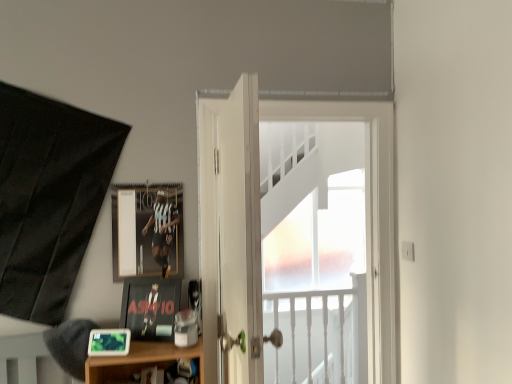
Question: Is white wooden door at center, positioned as the 2th door in back-to-front order, spatially inside white glossy door at center, marked as the first door in a back-to-front arrangement, or outside of it?

Choices:
 (A) outside
 (B) inside

Answer: (A)

Question: In the image, is white wooden door at center, which is the 1th door from front to back, positioned in front of or behind white glossy door at center, marked as the first door in a back-to-front arrangement?

Choices:
 (A) behind
 (B) front

Answer: (B)

Question: Which object is positioned closest to the white frosted glass at center?

Choices:
 (A) metallic silver picture frame at upper left, marked as the first picture frame in a top-to-bottom arrangement
 (B) white glossy door at center, positioned as the second door in front-to-back order
 (C) matte black picture frame at lower left, the second picture frame viewed from the front
 (D) white wooden door at center, which is the 1th door from front to back
 (E) matte black picture frame at lower left, which is the 1th picture frame from front to back

Answer: (B)

Question: Considering the real-world distances, which object is closest to the white wooden door at center, which is the 1th door from front to back?

Choices:
 (A) matte black picture frame at lower left, the second picture frame from the top
 (B) metallic silver picture frame at upper left, marked as the first picture frame in a top-to-bottom arrangement
 (C) white glossy door at center, positioned as the second door in front-to-back order
 (D) matte black picture frame at lower left, which is the 1th picture frame from front to back
 (E) white frosted glass at center

Answer: (C)